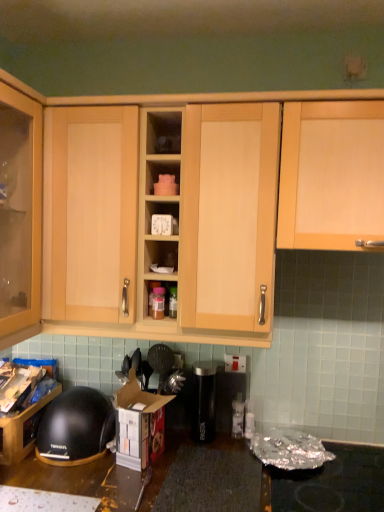
Describe the element at coordinates (136, 422) in the screenshot. I see `white cardboard box at lower center` at that location.

What is the approximate height of light wood cabinet door at upper right, which ranks as the first cabinetry in right-to-left order?

light wood cabinet door at upper right, which ranks as the first cabinetry in right-to-left order, is 50.33 centimeters tall.

Measure the distance between black plastic bowl at lower left, which is the third cabinetry from right to left, and camera.

The distance of black plastic bowl at lower left, which is the third cabinetry from right to left, from camera is 1.42 meters.

Where is `light wood cabinet at center, which appears as the 2th cabinetry when viewed from the left`? The height and width of the screenshot is (512, 384). light wood cabinet at center, which appears as the 2th cabinetry when viewed from the left is located at coordinates (187, 97).

Measure the distance between black plastic water filter at center, which is the first appliance from right to left, and camera.

1.69 meters.

Describe the element at coordinates (203, 401) in the screenshot. I see `black plastic canister at center, which ranks as the 2th appliance in right-to-left order` at that location.

The width and height of the screenshot is (384, 512). What do you see at coordinates (75, 426) in the screenshot?
I see `black matte helmet at lower left` at bounding box center [75, 426].

Locate an element on the screen. white cardboard box at lower center is located at coordinates (136, 422).

Is black matte helmet at lower left shorter than white cardboard box at lower center?

Indeed, black matte helmet at lower left has a lesser height compared to white cardboard box at lower center.

Find the location of a particular element. Image resolution: width=384 pixels, height=512 pixels. helmet behind the white cardboard box at lower center is located at coordinates (75, 426).

From the picture: What's the angular difference between black matte helmet at lower left and white cardboard box at lower center's facing directions?

They differ by 14.6 degrees in their facing directions.

Does point (59, 452) come closer to viewer compared to point (156, 400)?

Yes, point (59, 452) is in front of point (156, 400).

In order to click on cabinetry that is the 2nd object to the right of the white cardboard box at lower center, starting at the anchor in this screenshot , I will do pos(331,174).

Would you consider white cardboard box at lower center to be distant from light wood cabinet door at upper right, which ranks as the first cabinetry in right-to-left order?

Actually, white cardboard box at lower center and light wood cabinet door at upper right, which ranks as the first cabinetry in right-to-left order, are a little close together.

Is white cardboard box at lower center positioned with its back to light wood cabinet door at upper right, the 3th cabinetry from the left?

That's not correct — white cardboard box at lower center is not looking away from light wood cabinet door at upper right, the 3th cabinetry from the left.

From a real-world perspective, which object rests below the other?

white cardboard box at lower center, from a real-world perspective.

Does light wood cabinet door at upper right, the 3th cabinetry from the left, have a lesser height compared to white cardboard box at lower center?

In fact, light wood cabinet door at upper right, the 3th cabinetry from the left, may be taller than white cardboard box at lower center.

Is light wood cabinet door at upper right, which ranks as the first cabinetry in right-to-left order, next to white cardboard box at lower center and touching it?

light wood cabinet door at upper right, which ranks as the first cabinetry in right-to-left order, and white cardboard box at lower center are not in contact.

Considering the positions of objects light wood cabinet door at upper right, which ranks as the first cabinetry in right-to-left order, and white cardboard box at lower center in the image provided, who is more to the left, light wood cabinet door at upper right, which ranks as the first cabinetry in right-to-left order, or white cardboard box at lower center?

Positioned to the left is white cardboard box at lower center.

Is white cardboard box at lower center a part of light wood cabinet door at upper right, the 3th cabinetry from the left?

No, white cardboard box at lower center is not inside light wood cabinet door at upper right, the 3th cabinetry from the left.

How distant is black plastic water filter at center, which is the first appliance from right to left, from matte wood cabinet at center?

The distance of black plastic water filter at center, which is the first appliance from right to left, from matte wood cabinet at center is 36.86 inches.

Is black plastic water filter at center, the second appliance viewed from the left, positioned with its back to matte wood cabinet at center?

That's not correct — black plastic water filter at center, the second appliance viewed from the left, is not looking away from matte wood cabinet at center.

Considering the relative sizes of black plastic water filter at center, which is the first appliance from right to left, and matte wood cabinet at center in the image provided, is black plastic water filter at center, which is the first appliance from right to left, wider than matte wood cabinet at center?

No.

From a real-world perspective, relative to matte wood cabinet at center, is black plastic water filter at center, the second appliance viewed from the left, vertically above or below?

black plastic water filter at center, the second appliance viewed from the left, is below matte wood cabinet at center.

From the image's perspective, between white cardboard box at lower center and black matte helmet at lower left, which one is located above?

From the image's view, white cardboard box at lower center is above.

How different are the orientations of white cardboard box at lower center and black matte helmet at lower left in degrees?

14.6 degrees separate the facing orientations of white cardboard box at lower center and black matte helmet at lower left.

Between white cardboard box at lower center and black matte helmet at lower left, which one is positioned in front?

white cardboard box at lower center is more forward.

Is white cardboard box at lower center bigger or smaller than black matte helmet at lower left?

In the image, white cardboard box at lower center appears to be smaller than black matte helmet at lower left.

Between white cardboard box at lower center and black plastic canister at center, which ranks as the 2th appliance in right-to-left order, which one appears on the right side from the viewer's perspective?

Positioned to the right is black plastic canister at center, which ranks as the 2th appliance in right-to-left order.

Could you tell me if white cardboard box at lower center is facing black plastic canister at center, which appears as the first appliance when viewed from the left?

No, white cardboard box at lower center does not turn towards black plastic canister at center, which appears as the first appliance when viewed from the left.

From a real-world perspective, count 1st appliances downward from the white cardboard box at lower center and point to it. Please provide its 2D coordinates.

[(203, 401)]

Considering the sizes of objects white cardboard box at lower center and black plastic canister at center, which ranks as the 2th appliance in right-to-left order, in the image provided, who is shorter, white cardboard box at lower center or black plastic canister at center, which ranks as the 2th appliance in right-to-left order,?

black plastic canister at center, which ranks as the 2th appliance in right-to-left order.

From the image's perspective, does black plastic canister at center, which appears as the first appliance when viewed from the left, appear higher than light wood cabinet at center, the second cabinetry when ordered from right to left?

No, from the image's perspective, black plastic canister at center, which appears as the first appliance when viewed from the left, is not above light wood cabinet at center, the second cabinetry when ordered from right to left.

Can you confirm if black plastic canister at center, which ranks as the 2th appliance in right-to-left order, is taller than light wood cabinet at center, the second cabinetry when ordered from right to left?

In fact, black plastic canister at center, which ranks as the 2th appliance in right-to-left order, may be shorter than light wood cabinet at center, the second cabinetry when ordered from right to left.

Are black plastic canister at center, which ranks as the 2th appliance in right-to-left order, and light wood cabinet at center, which appears as the 2th cabinetry when viewed from the left, far apart?

That's right, there is a large distance between black plastic canister at center, which ranks as the 2th appliance in right-to-left order, and light wood cabinet at center, which appears as the 2th cabinetry when viewed from the left.

Is black plastic canister at center, which ranks as the 2th appliance in right-to-left order, in front of or behind light wood cabinet at center, which appears as the 2th cabinetry when viewed from the left, in the image?

Clearly, black plastic canister at center, which ranks as the 2th appliance in right-to-left order, is behind light wood cabinet at center, which appears as the 2th cabinetry when viewed from the left.

Where is `helmet behind the white cardboard box at lower center`? This screenshot has width=384, height=512. helmet behind the white cardboard box at lower center is located at coordinates (75, 426).

This screenshot has width=384, height=512. In the image, there is a light wood cabinet door at upper right, which ranks as the first cabinetry in right-to-left order. What are the coordinates of `cardboard box below it (from the image's perspective)` in the screenshot? It's located at (136, 422).

Which object lies further to the anchor point black matte helmet at lower left, matte wood cabinet at center or light wood cabinet door at upper right, the 3th cabinetry from the left?

light wood cabinet door at upper right, the 3th cabinetry from the left, is positioned further to the anchor black matte helmet at lower left.

Based on their spatial positions, is light wood cabinet door at upper right, the 3th cabinetry from the left, or black plastic bowl at lower left, which appears as the first cabinetry when viewed from the left, closer to light wood cabinet at center, the second cabinetry when ordered from right to left?

light wood cabinet door at upper right, the 3th cabinetry from the left, is positioned closer to the anchor light wood cabinet at center, the second cabinetry when ordered from right to left.

Which object lies nearer to the anchor point black matte helmet at lower left, matte wood cabinet at center or black plastic canister at center, which ranks as the 2th appliance in right-to-left order?

Among the two, black plastic canister at center, which ranks as the 2th appliance in right-to-left order, is located nearer to black matte helmet at lower left.

Estimate the real-world distances between objects in this image. Which object is further from light wood cabinet at center, the second cabinetry when ordered from right to left, black matte helmet at lower left or matte wood cabinet at center?

Based on the image, black matte helmet at lower left appears to be further to light wood cabinet at center, the second cabinetry when ordered from right to left.

Based on the photo, considering their positions, is matte wood cabinet at center positioned closer to black plastic canister at center, which appears as the first appliance when viewed from the left, than light wood cabinet at center, which appears as the 2th cabinetry when viewed from the left?

matte wood cabinet at center is closer to black plastic canister at center, which appears as the first appliance when viewed from the left.

Consider the image. Looking at the image, which one is located closer to matte wood cabinet at center, black plastic water filter at center, which is the first appliance from right to left, or light wood cabinet at center, the second cabinetry when ordered from right to left?

light wood cabinet at center, the second cabinetry when ordered from right to left.

Estimate the real-world distances between objects in this image. Which object is further from light wood cabinet at center, the second cabinetry when ordered from right to left, black plastic water filter at center, which is the first appliance from right to left, or black matte helmet at lower left?

black matte helmet at lower left lies further to light wood cabinet at center, the second cabinetry when ordered from right to left, than the other object.

Based on their spatial positions, is matte wood cabinet at center or black plastic bowl at lower left, which is the third cabinetry from right to left, closer to black plastic canister at center, which appears as the first appliance when viewed from the left?

Among the two, black plastic bowl at lower left, which is the third cabinetry from right to left, is located nearer to black plastic canister at center, which appears as the first appliance when viewed from the left.

The height and width of the screenshot is (512, 384). Find the location of `cardboard box located between black plastic bowl at lower left, which appears as the first cabinetry when viewed from the left, and light wood cabinet door at upper right, which ranks as the first cabinetry in right-to-left order, in the left-right direction`. cardboard box located between black plastic bowl at lower left, which appears as the first cabinetry when viewed from the left, and light wood cabinet door at upper right, which ranks as the first cabinetry in right-to-left order, in the left-right direction is located at coordinates (136, 422).

The height and width of the screenshot is (512, 384). What are the coordinates of `cardboard box located between black plastic bowl at lower left, which is the third cabinetry from right to left, and black plastic water filter at center, which is the first appliance from right to left, in the left-right direction` in the screenshot? It's located at (136, 422).

In order to click on helmet between matte wood cabinet at center and black plastic bowl at lower left, which appears as the first cabinetry when viewed from the left, in the vertical direction in this screenshot , I will do `click(75, 426)`.

The width and height of the screenshot is (384, 512). Find the location of `cardboard box between matte wood cabinet at center and black matte helmet at lower left in the up-down direction`. cardboard box between matte wood cabinet at center and black matte helmet at lower left in the up-down direction is located at coordinates (136, 422).